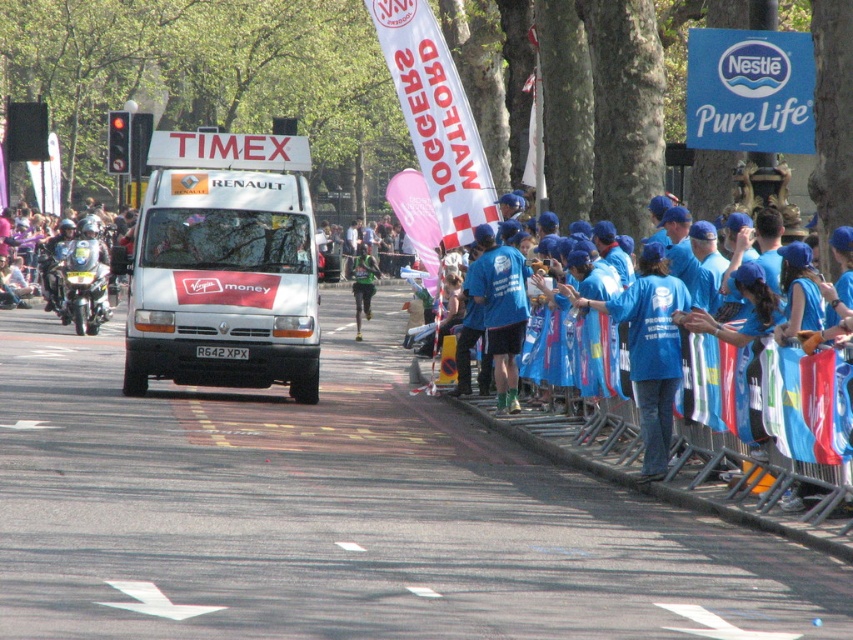
You are a photographer positioned at the starting line of a marathon. You want to capture a photo that includes both the white matte van at center and the green fabric runner at center. Which object should you focus on first to ensure both are in clear view?

You should focus on the white matte van at center first since it is closer to the viewer than the green fabric runner at center. By focusing on the closer object, you can ensure both are in acceptable focus due to the depth of field extending beyond the van to include the runner.

You are a runner participating in the marathon and see the white matte van at center and the blue fabric shirt at center. Which object is closer to the starting line?

The white matte van at center is closer to the starting line because it is positioned to the left of the blue fabric shirt at center, and in a marathon setup, objects to the left are typically closer to the start.